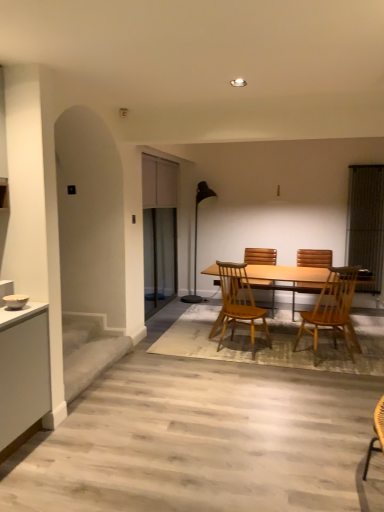
Question: From the image's perspective, is black mesh screen at right above or below light brown wooden table at center?

Choices:
 (A) below
 (B) above

Answer: (B)

Question: From a real-world perspective, is black mesh screen at right above or below light brown wooden table at center?

Choices:
 (A) below
 (B) above

Answer: (B)

Question: Which object is positioned farthest from the black metal floor lamp at center?

Choices:
 (A) light brown wooden table at center
 (B) clear glass screen door at center
 (C) matte gray cabinet at upper center
 (D) light brown wooden chair at center, which ranks as the 3th chair in back-to-front order
 (E) wooden at center, the 4th chair positioned from the front

Answer: (D)

Question: Based on their relative distances, which object is farther from the black mesh screen at right?

Choices:
 (A) wooden chair at center, the 4th chair in the back-to-front sequence
 (B) wooden at center, placed as the 1th chair when sorted from back to front
 (C) black metal floor lamp at center
 (D) matte gray cabinet at upper center
 (E) light brown wooden chair at center, which ranks as the 3th chair in back-to-front order

Answer: (D)